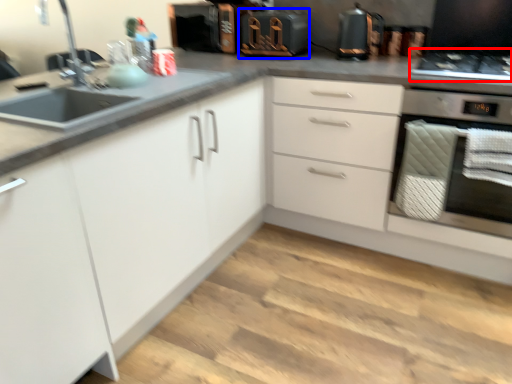
Question: Which of the following is the closest to the observer, gas stove (highlighted by a red box) or appliance (highlighted by a blue box)?

Choices:
 (A) gas stove
 (B) appliance

Answer: (A)